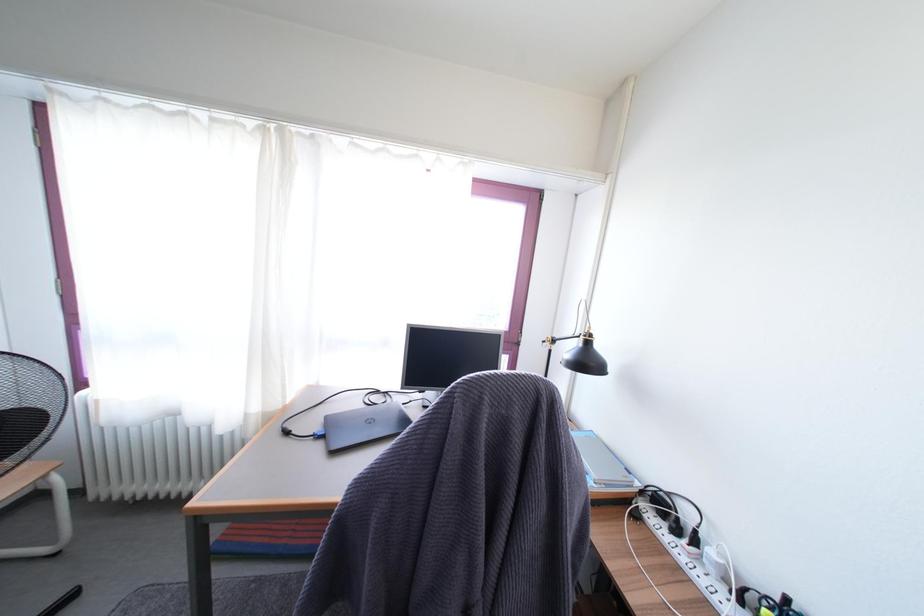
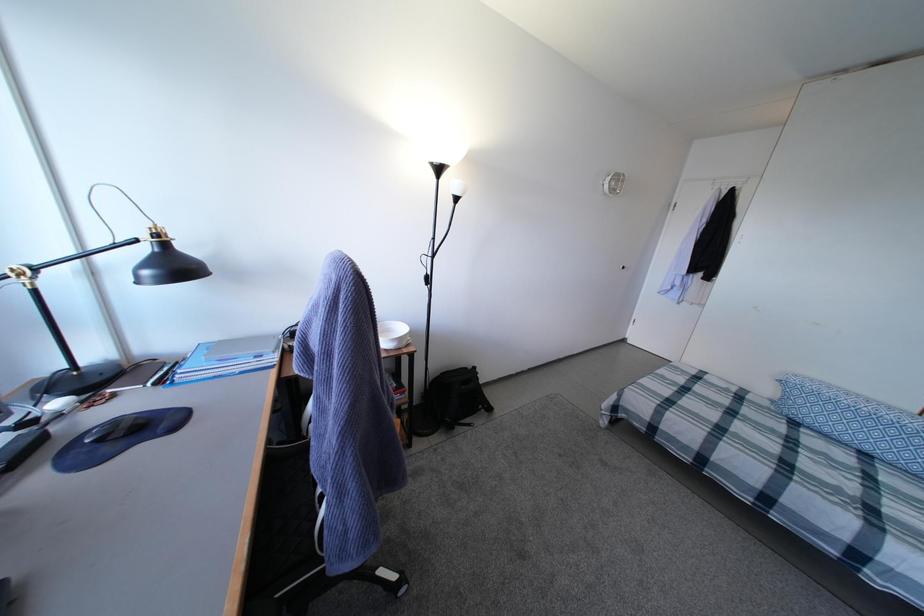
The images are taken continuously from a first-person perspective. In which direction is your viewpoint rotating?

The rotation direction of the camera is right-down.